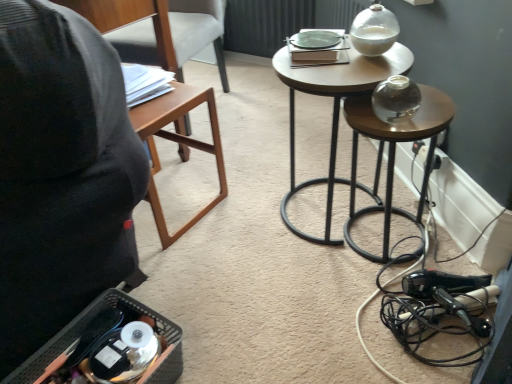
Question: Does transparent glass vase at center right, the first stool in the right-to-left sequence, have a lesser width compared to brown wood table at left?

Choices:
 (A) yes
 (B) no

Answer: (B)

Question: From a real-world perspective, is transparent glass vase at center right, positioned as the second stool in left-to-right order, located higher than brown wood table at left?

Choices:
 (A) no
 (B) yes

Answer: (B)

Question: Can you confirm if transparent glass vase at center right, positioned as the second stool in left-to-right order, is positioned to the right of brown wood table at left?

Choices:
 (A) no
 (B) yes

Answer: (B)

Question: Is transparent glass vase at center right, the first stool in the right-to-left sequence, positioned behind brown wood table at left?

Choices:
 (A) no
 (B) yes

Answer: (A)

Question: Does transparent glass vase at center right, the first stool in the right-to-left sequence, have a larger size compared to brown wood table at left?

Choices:
 (A) yes
 (B) no

Answer: (B)

Question: Is brown wood table at left inside transparent glass vase at center right, the first stool in the right-to-left sequence?

Choices:
 (A) yes
 (B) no

Answer: (B)

Question: Is brown wood table at left wider than transparent glass vase at center right, the first stool in the right-to-left sequence?

Choices:
 (A) yes
 (B) no

Answer: (B)

Question: Is brown wood table at left looking in the opposite direction of transparent glass vase at center right, positioned as the second stool in left-to-right order?

Choices:
 (A) no
 (B) yes

Answer: (A)

Question: Is brown wood table at left at the right side of transparent glass vase at center right, positioned as the second stool in left-to-right order?

Choices:
 (A) yes
 (B) no

Answer: (B)

Question: From the image's perspective, does brown wood table at left appear lower than transparent glass vase at center right, the first stool in the right-to-left sequence?

Choices:
 (A) no
 (B) yes

Answer: (A)

Question: Considering the relative sizes of brown wood table at left and transparent glass vase at center right, positioned as the second stool in left-to-right order, in the image provided, is brown wood table at left thinner than transparent glass vase at center right, positioned as the second stool in left-to-right order,?

Choices:
 (A) no
 (B) yes

Answer: (B)

Question: From a real-world perspective, is brown wood table at left physically above transparent glass vase at center right, the first stool in the right-to-left sequence?

Choices:
 (A) no
 (B) yes

Answer: (A)

Question: Is wooden chair at left taller than white plastic electric outlet at lower right?

Choices:
 (A) yes
 (B) no

Answer: (A)